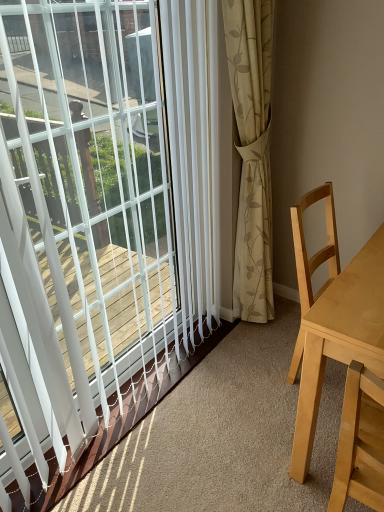
Question: Is white plastic blinds at upper left next to light wood table at right?

Choices:
 (A) no
 (B) yes

Answer: (A)

Question: Does white plastic blinds at upper left have a greater height compared to light wood table at right?

Choices:
 (A) no
 (B) yes

Answer: (B)

Question: Is light wood table at right located within white plastic blinds at upper left?

Choices:
 (A) no
 (B) yes

Answer: (A)

Question: Is white plastic blinds at upper left to the right of light wood table at right from the viewer's perspective?

Choices:
 (A) no
 (B) yes

Answer: (A)

Question: Is the depth of white plastic blinds at upper left greater than that of light wood table at right?

Choices:
 (A) yes
 (B) no

Answer: (B)

Question: Are white plastic blinds at upper left and light wood table at right located far from each other?

Choices:
 (A) yes
 (B) no

Answer: (B)

Question: Is light wood table at right looking in the opposite direction of white plastic blinds at upper left?

Choices:
 (A) yes
 (B) no

Answer: (B)

Question: Would you say white plastic blinds at upper left is part of light wood table at right's contents?

Choices:
 (A) yes
 (B) no

Answer: (B)

Question: Is light wood table at right to the left of white plastic blinds at upper left from the viewer's perspective?

Choices:
 (A) yes
 (B) no

Answer: (B)

Question: Are light wood table at right and white plastic blinds at upper left located far from each other?

Choices:
 (A) no
 (B) yes

Answer: (A)

Question: Is light wood table at right taller than white plastic blinds at upper left?

Choices:
 (A) yes
 (B) no

Answer: (B)

Question: From the image's perspective, is light wood table at right below white plastic blinds at upper left?

Choices:
 (A) no
 (B) yes

Answer: (B)

Question: From a real-world perspective, is light wood table at right physically located above or below white plastic blinds at upper left?

Choices:
 (A) above
 (B) below

Answer: (B)